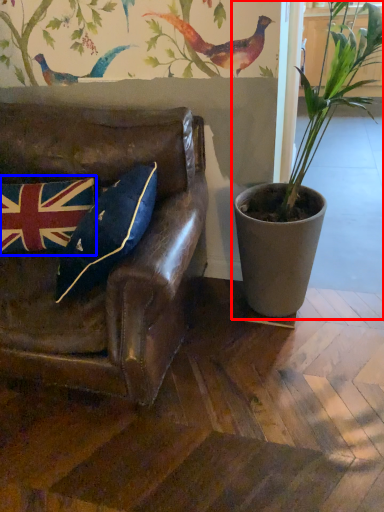
Question: Among these objects, which one is nearest to the camera, houseplant (highlighted by a red box) or flag (highlighted by a blue box)?

Choices:
 (A) houseplant
 (B) flag

Answer: (A)